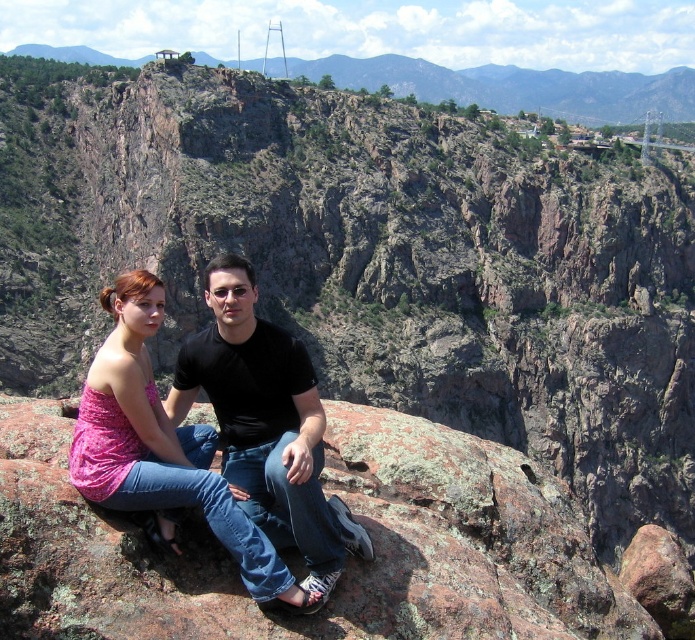
Can you confirm if black matte shirt at center is positioned to the right of rustic rock formation at upper center?

No, black matte shirt at center is not to the right of rustic rock formation at upper center.

Locate an element on the screen. The height and width of the screenshot is (640, 695). black matte shirt at center is located at coordinates (265, 422).

Where is `black matte shirt at center`? The height and width of the screenshot is (640, 695). black matte shirt at center is located at coordinates (265, 422).